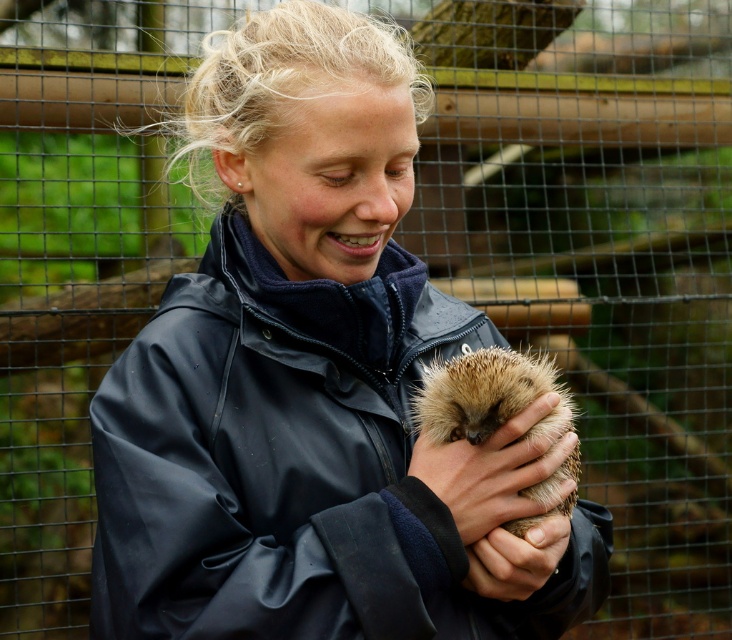
Consider the image. You are a fashion designer who wants to create a jacket that fits over the smooth brown hand at center. Based on the scene, can the dark blue waterproof jacket at center be used as a reference for the hand size? Explain why or why not.

The dark blue waterproof jacket at center has a larger width than the smooth brown hand at center. Since the jacket is wider, it can accommodate the hand comfortably, making it a suitable reference for designing a jacket that fits over the hand.

You are a zookeeper who needs to ensure the hedgehog is safely held without causing discomfort. Based on the image, can the smooth brown hand at center comfortably hold the brown fuzzy hedgehog at center without overlapping its edges?

The brown fuzzy hedgehog at center might be wider than smooth brown hand at center, so there is a possibility that the hedgehog may not fit comfortably within the hand without overlapping, which could cause discomfort. Adjust the grip to ensure a secure and comfortable hold.